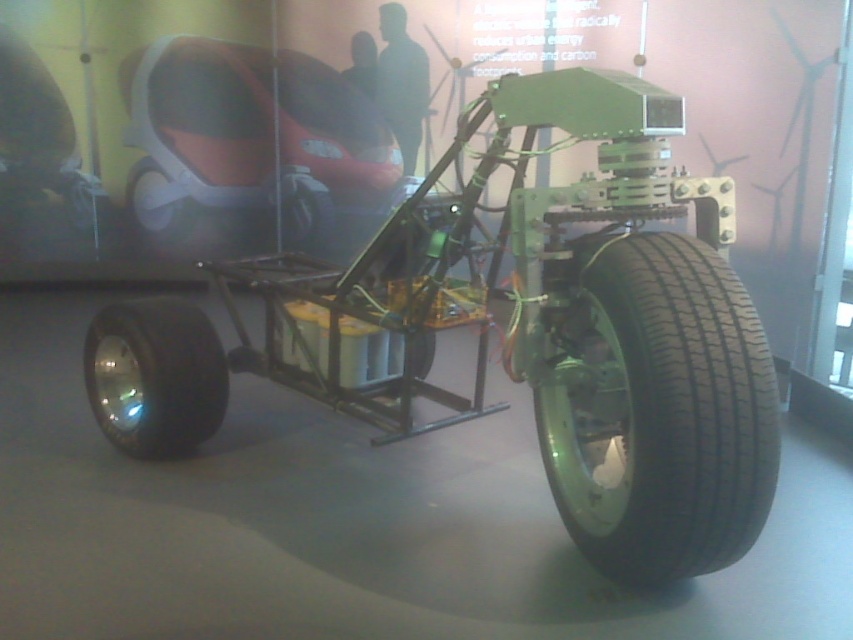
From the picture: You are an engineer inspecting the vehicle chassis. You notice a point marked at coordinates (299, 209). Based on the scene description, what object is located at this point?

The point at coordinates (299, 209) indicates the location of the black rubber wheel at center.

From the picture: You are an engineer inspecting the vehicle chassis. You notice the black rubber wheel at center and the metallic silver wheel at center. Which wheel is positioned lower in the chassis structure?

The black rubber wheel at center is located below the metallic silver wheel at center, so it is positioned lower in the chassis structure.